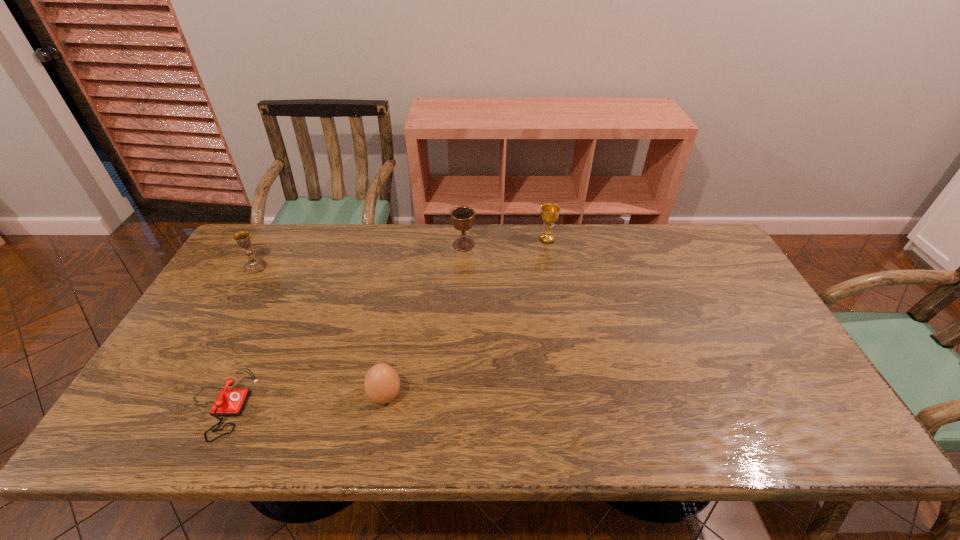
Locate an element on the screen. This screenshot has height=540, width=960. free location located 0.240m on the back of the third object from right to left is located at coordinates (400, 310).

This screenshot has height=540, width=960. Identify the location of vacant region located on the dial of the shortest object. (276, 404).

The image size is (960, 540). Identify the location of boiled egg positioned at the near edge. (381, 383).

The height and width of the screenshot is (540, 960). I want to click on telephone at the near edge, so click(x=230, y=401).

At what (x,y) coordinates should I click in order to perform the action: click on chalice that is at the left edge. Please return your answer as a coordinate pair (x, y). The width and height of the screenshot is (960, 540). Looking at the image, I should click on (253, 265).

Find the location of a particular element. The width and height of the screenshot is (960, 540). telephone that is positioned at the left edge is located at coordinates (230, 401).

Locate an element on the screen. This screenshot has height=540, width=960. object situated at the far left corner is located at coordinates (253, 265).

Identify the location of object that is at the near left corner. (230, 401).

In the image, there is a desktop. Identify the location of vacant space at the far edge. This screenshot has height=540, width=960. (366, 229).

Locate an element on the screen. This screenshot has width=960, height=540. vacant space at the near edge is located at coordinates (336, 426).